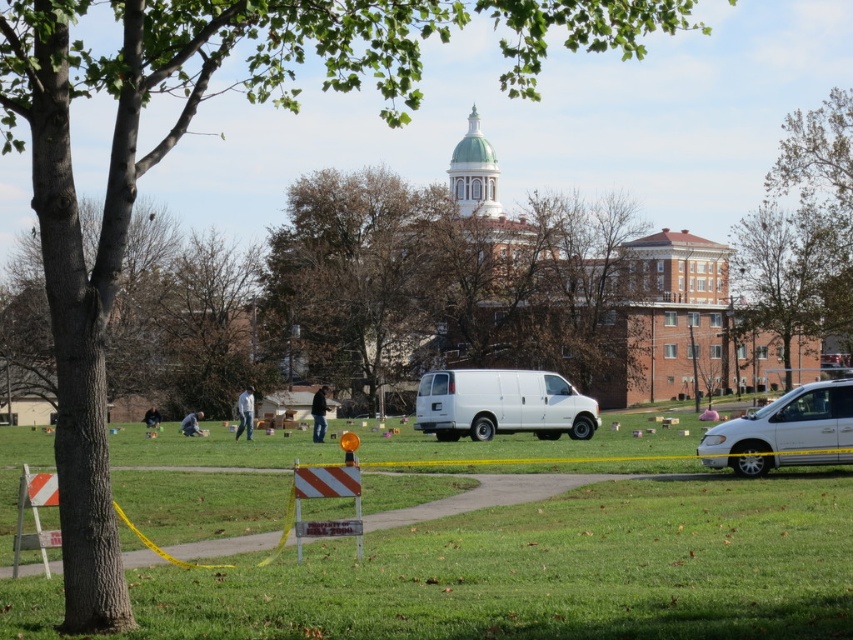
Who is positioned more to the right, green grass at center or dark blue jeans at center?

Positioned to the right is green grass at center.

Who is lower down, green grass at center or dark blue jeans at center?

dark blue jeans at center

Describe the element at coordinates (548, 566) in the screenshot. I see `green grass at center` at that location.

Image resolution: width=853 pixels, height=640 pixels. Find the location of `green grass at center`. green grass at center is located at coordinates (548, 566).

Which is behind, point (717, 428) or point (316, 419)?

Point (316, 419)

Who is positioned more to the right, white matte van at lower right or black leather jacket at center?

white matte van at lower right is more to the right.

Between point (711, 451) and point (322, 429), which one is positioned behind?

The point (322, 429) is behind.

Where is `white matte van at lower right`? This screenshot has height=640, width=853. white matte van at lower right is located at coordinates pyautogui.click(x=785, y=432).

Image resolution: width=853 pixels, height=640 pixels. Describe the element at coordinates (502, 404) in the screenshot. I see `white matte van at center` at that location.

Can you confirm if white matte van at center is bigger than black leather jacket at center?

No, white matte van at center is not bigger than black leather jacket at center.

Between point (526, 420) and point (323, 387), which one is positioned behind?

Point (323, 387)

Locate an element on the screen. Image resolution: width=853 pixels, height=640 pixels. white matte van at center is located at coordinates (502, 404).